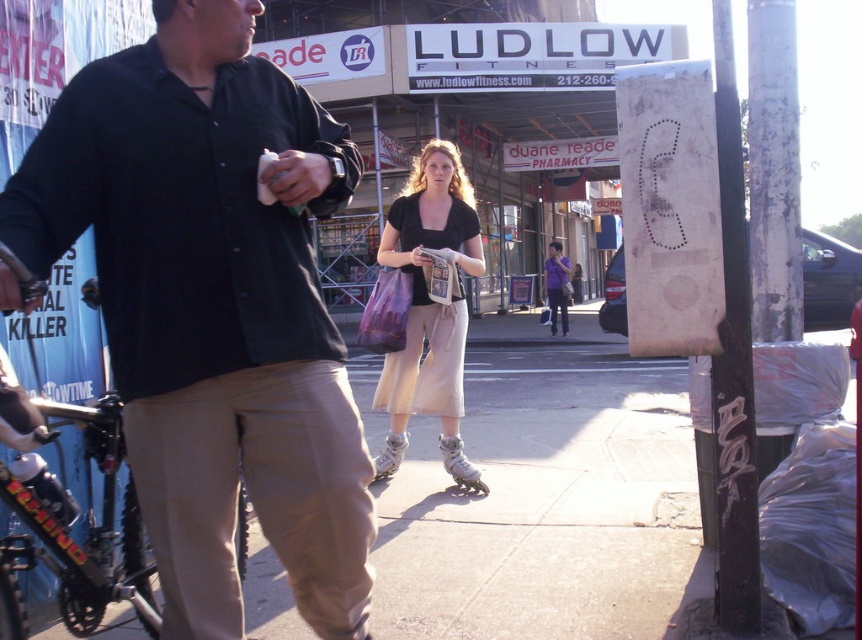
From the picture: What object is located at the coordinates point [431,308]?

The point [431,308] corresponds to the matte black shirt at center.

Based on the photo, you are a pedestrian trying to cross the street. You see the light brown concrete sidewalk at center and the khaki cotton pants at lower center. Which direction should you walk to reach the sidewalk?

You should walk to the right because the light brown concrete sidewalk at center is to the right of the khaki cotton pants at lower center.